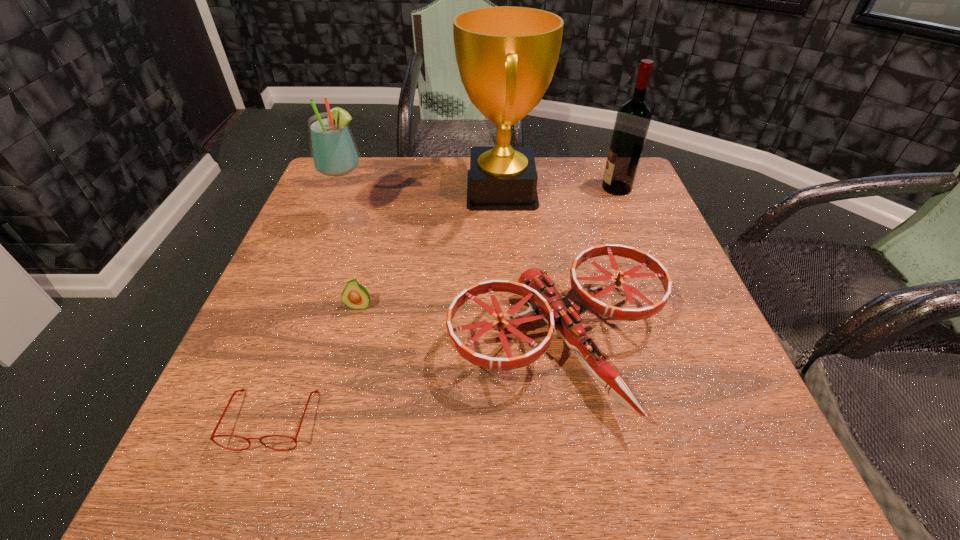
Find the location of a particular element. This screenshot has width=960, height=540. blank space located 0.270m on the front and back of the farther alcohol is located at coordinates (503, 188).

At what (x,y) coordinates should I click in order to perform the action: click on free region located 0.380m on the front and back of the farther alcohol. Please return your answer as a coordinate pair (x, y). The height and width of the screenshot is (540, 960). Looking at the image, I should click on (463, 188).

The image size is (960, 540). In order to click on vacant space located 0.270m on the front of the nearer alcohol in this screenshot , I will do `click(319, 321)`.

Where is `free point located on the left of the fourth tallest object`? free point located on the left of the fourth tallest object is located at coordinates (400, 345).

The width and height of the screenshot is (960, 540). Find the location of `vacant space located on the cut side of the fifth tallest object`. vacant space located on the cut side of the fifth tallest object is located at coordinates (352, 333).

Find the location of `award present at the far edge`. award present at the far edge is located at coordinates (506, 56).

I want to click on alcohol present at the far edge, so point(633,118).

Where is `object present at the near edge`? The image size is (960, 540). object present at the near edge is located at coordinates (242, 390).

Where is `alcohol situated at the left edge`? Image resolution: width=960 pixels, height=540 pixels. alcohol situated at the left edge is located at coordinates (334, 154).

You are a GUI agent. You are given a task and a screenshot of the screen. Output one action in this format:
    pyautogui.click(x=<x>, y=<y>)
    Task: Click on the spectacles that is at the left edge
    This screenshot has height=540, width=960.
    Given the screenshot: What is the action you would take?
    pyautogui.click(x=242, y=390)